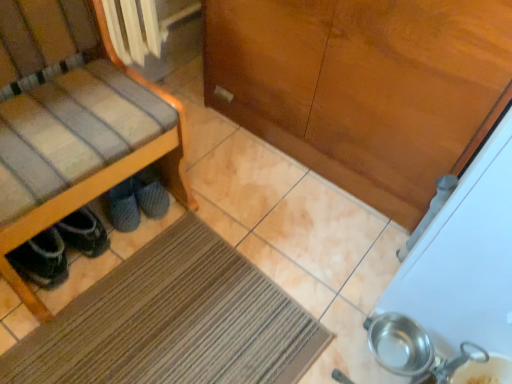
The width and height of the screenshot is (512, 384). Find the location of `vacant space behind brown textured mat at lower center`. vacant space behind brown textured mat at lower center is located at coordinates (251, 202).